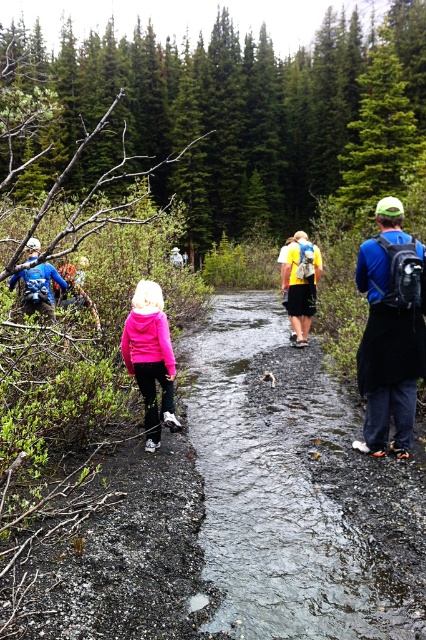
You are a hiker trying to cross the wet gravel stream at center and avoid getting your matte blue jacket at left wet. Since the stream is larger, which direction should you move to stay dry?

The wet gravel stream at center has a larger size compared to matte blue jacket at left, so you should move towards the matte blue jacket at left to avoid the larger stream and keep your jacket dry.

You are a hiker trying to reach a point marked at coordinates (416, 273) in the image. Given that the path is muddy and flooded, and you have a 15 feet rope, can you safely reach that point without getting too close to the edge?

The point at (416, 273) is 16.89 feet away from the camera. Since your rope is only 15 feet long, it is not long enough to safely reach that point without getting too close to the edge.